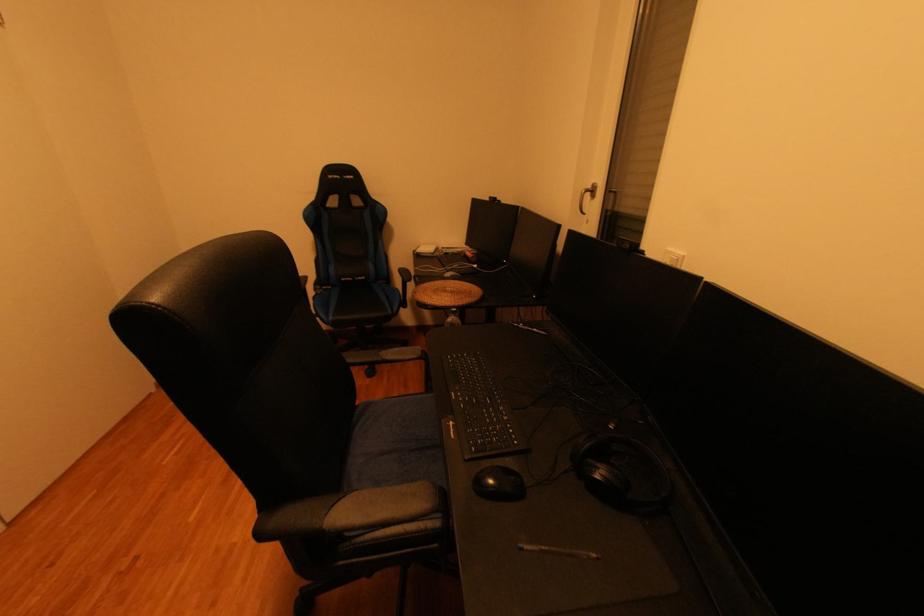
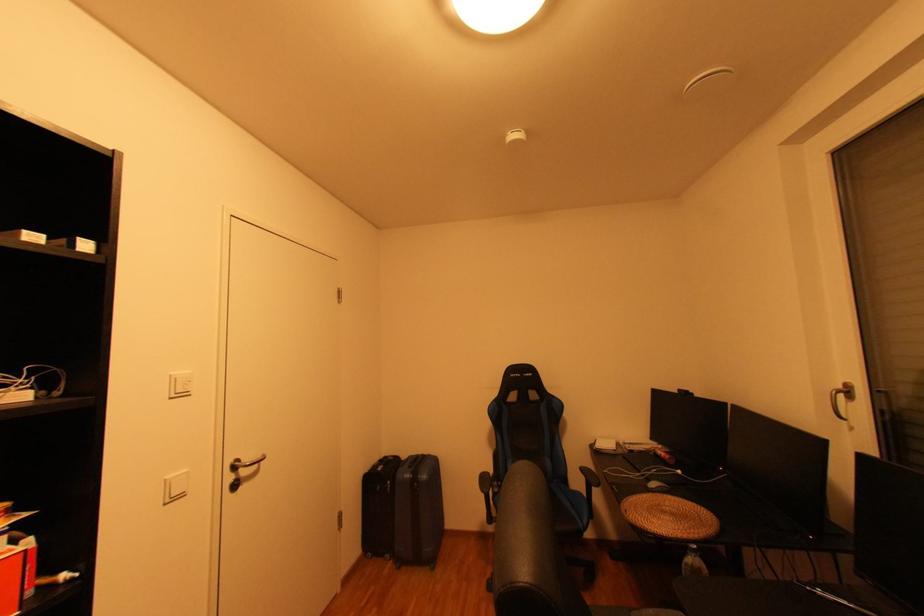
Where in the second image is the point corresponding to pixel 458 275 from the first image?

(663, 485)